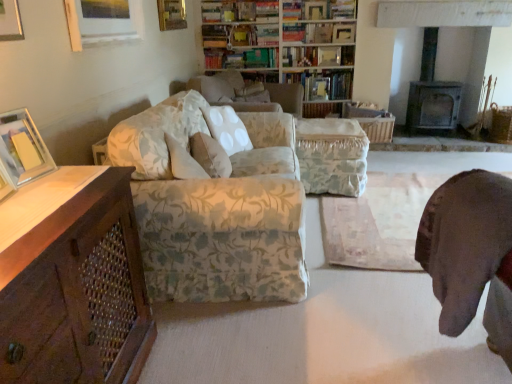
Question: Considering the relative positions of floral fabric bookcase at upper center and fluffy white pillow at center in the image provided, is floral fabric bookcase at upper center to the right of fluffy white pillow at center from the viewer's perspective?

Choices:
 (A) no
 (B) yes

Answer: (B)

Question: Does floral fabric bookcase at upper center have a lesser width compared to fluffy white pillow at center?

Choices:
 (A) no
 (B) yes

Answer: (A)

Question: Can you confirm if floral fabric bookcase at upper center is shorter than fluffy white pillow at center?

Choices:
 (A) yes
 (B) no

Answer: (B)

Question: Can you confirm if floral fabric bookcase at upper center is smaller than fluffy white pillow at center?

Choices:
 (A) no
 (B) yes

Answer: (A)

Question: Is floral fabric bookcase at upper center outside fluffy white pillow at center?

Choices:
 (A) yes
 (B) no

Answer: (A)

Question: From a real-world perspective, does floral fabric bookcase at upper center stand above fluffy white pillow at center?

Choices:
 (A) no
 (B) yes

Answer: (B)

Question: From a real-world perspective, is hardcover book at upper center, which is the 3th book from bottom to top, over wooden picture frame at upper left, which is the 1th picture frame in left-to-right order?

Choices:
 (A) no
 (B) yes

Answer: (A)

Question: Is wooden picture frame at upper left, which ranks as the 3th picture frame in top-to-bottom order, completely or partially inside hardcover book at upper center, which is the 3th book from bottom to top?

Choices:
 (A) yes
 (B) no

Answer: (B)

Question: Are hardcover book at upper center, acting as the 3th book starting from the top, and wooden picture frame at upper left, which ranks as the 3th picture frame in top-to-bottom order, far apart?

Choices:
 (A) yes
 (B) no

Answer: (A)

Question: Is hardcover book at upper center, which is the 3th book from bottom to top, turned away from wooden picture frame at upper left, which is the third picture frame in back-to-front order?

Choices:
 (A) yes
 (B) no

Answer: (B)

Question: Does hardcover book at upper center, which is the 3th book from bottom to top, have a lesser width compared to wooden picture frame at upper left, which ranks as the 3th picture frame in top-to-bottom order?

Choices:
 (A) no
 (B) yes

Answer: (A)

Question: Does hardcover book at upper center, which is the 3th book from bottom to top, have a smaller size compared to wooden picture frame at upper left, which is the third picture frame in back-to-front order?

Choices:
 (A) no
 (B) yes

Answer: (A)

Question: Would you say floral fabric bookcase at upper center is outside wooden picture frame at upper left, which is the third picture frame in back-to-front order?

Choices:
 (A) yes
 (B) no

Answer: (A)